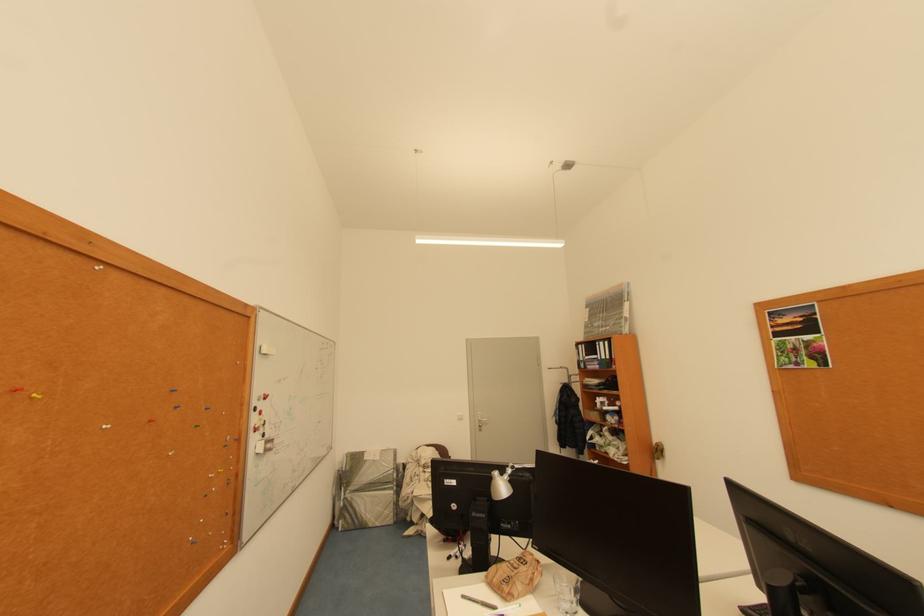
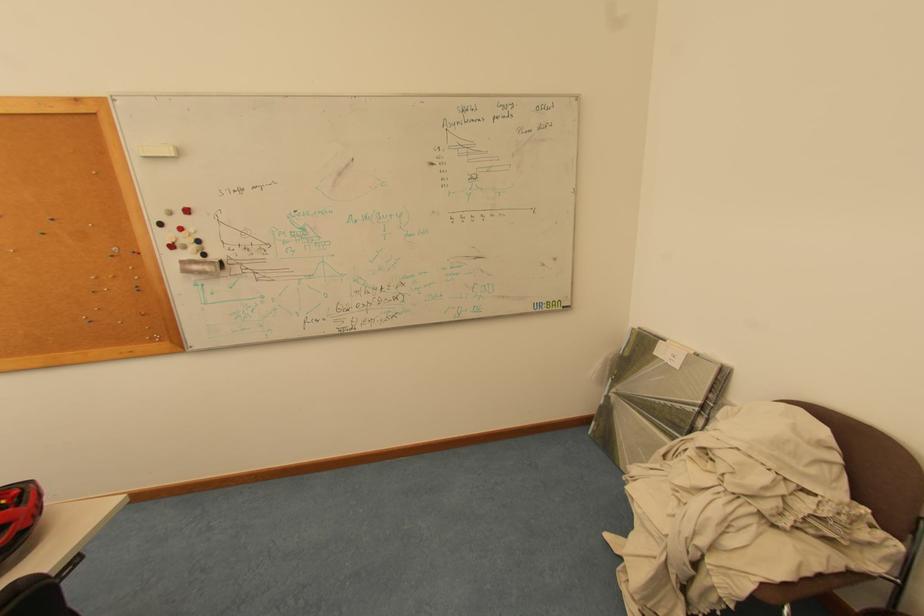
In the second image, find the point that corresponds to point 357,493 in the first image.

(622, 392)